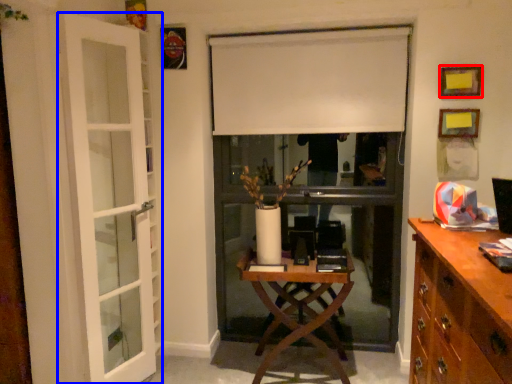
Question: Which of the following is the farthest to the observer, picture frame (highlighted by a red box) or door (highlighted by a blue box)?

Choices:
 (A) picture frame
 (B) door

Answer: (A)